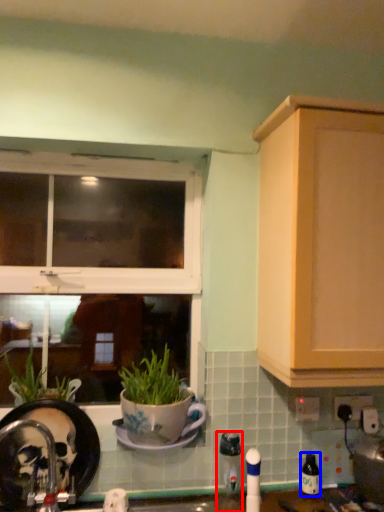
Question: Which point is further to the camera, appliance (highlighted by a red box) or bottle (highlighted by a blue box)?

Choices:
 (A) appliance
 (B) bottle

Answer: (B)